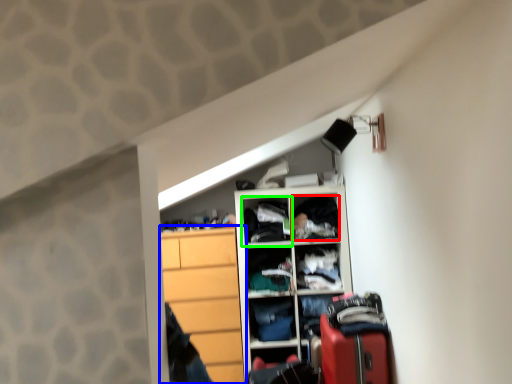
Question: Which is farther away from clothing (highlighted by a red box)? cabinetry (highlighted by a blue box) or cabinet (highlighted by a green box)?

Choices:
 (A) cabinetry
 (B) cabinet

Answer: (A)